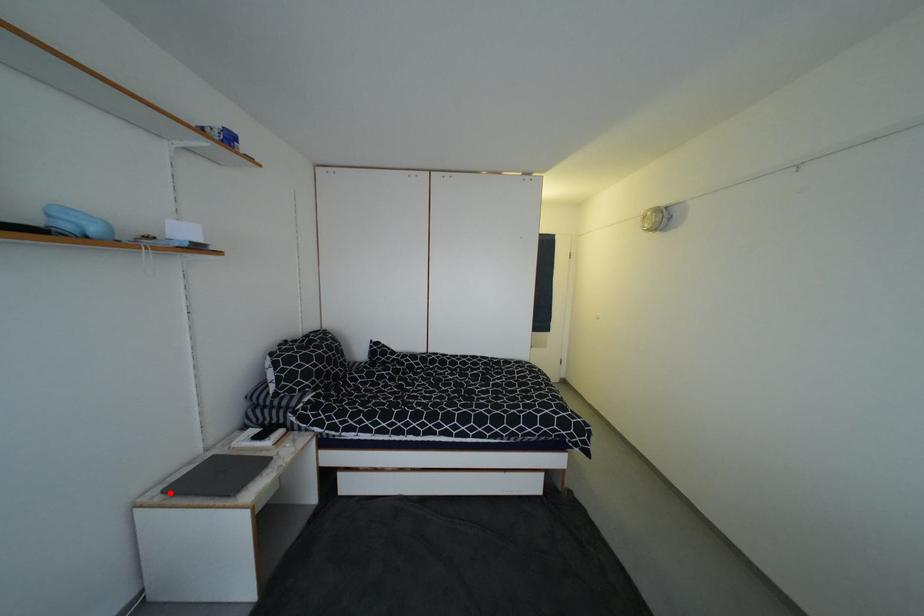
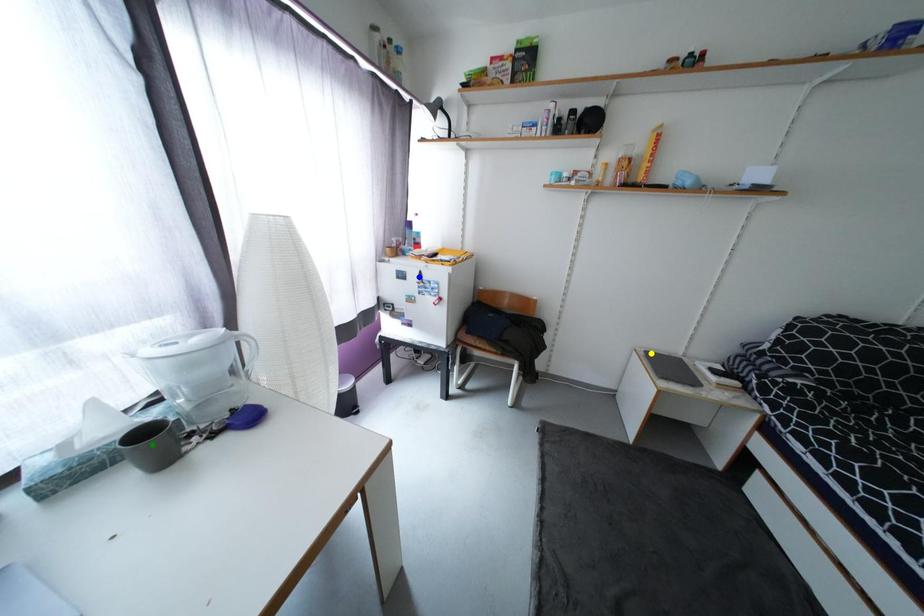
Question: I am providing you with two images of the same scene from different viewpoints. A red point is marked on the first image. You are given multiple points on the second image. Which point in image 2 is actually the same real-world point as the red point in image 1?

Choices:
 (A) blue point
 (B) yellow point
 (C) green point

Answer: (B)